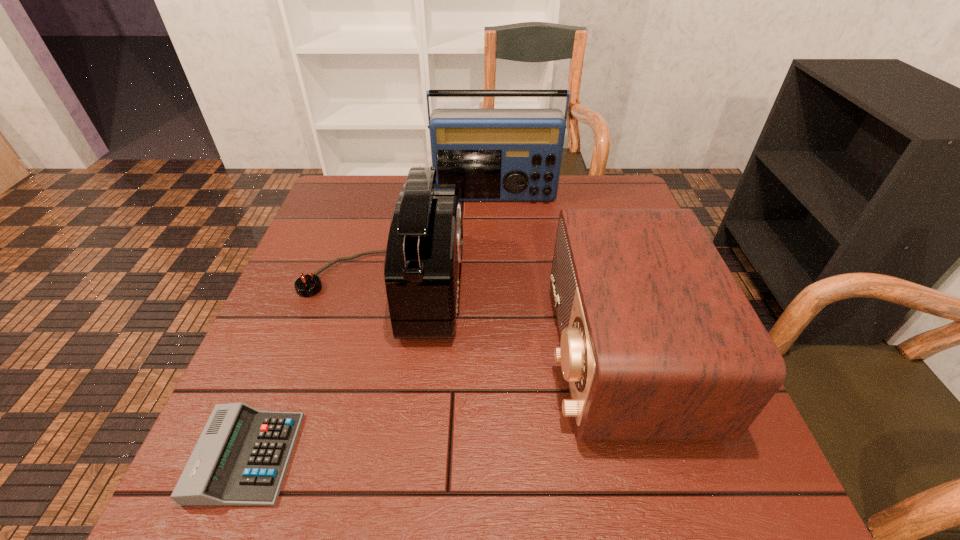
At what (x,y) coordinates should I click in order to perform the action: click on the farthest object. Please return your answer as a coordinate pair (x, y). Looking at the image, I should click on (491, 154).

The width and height of the screenshot is (960, 540). What are the coordinates of `the second tallest object` in the screenshot? It's located at (424, 250).

Where is `the third tallest object`? This screenshot has height=540, width=960. the third tallest object is located at coordinates (658, 342).

Identify the location of the shortest object. (241, 457).

Locate an element on the screen. free space located on the front panel of the farthest object is located at coordinates (500, 294).

Where is `blank space located 0.320m on the front-facing side of the third shortest object`? This screenshot has height=540, width=960. blank space located 0.320m on the front-facing side of the third shortest object is located at coordinates (599, 286).

The image size is (960, 540). What are the coordinates of `free location located on the front panel of the shortest radio receiver` in the screenshot? It's located at (412, 352).

Locate an element on the screen. Image resolution: width=960 pixels, height=540 pixels. blank space located on the front panel of the shortest radio receiver is located at coordinates (495, 352).

The width and height of the screenshot is (960, 540). Identify the location of vacant region located 0.130m on the front panel of the shortest radio receiver. (485, 352).

Identify the location of free space located 0.370m on the right of the shortest object. This screenshot has width=960, height=540. (x=513, y=457).